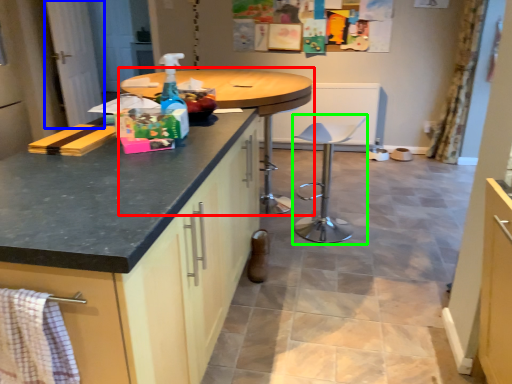
Question: Based on their relative distances, which object is nearer to table (highlighted by a red box)? Choose from screen door (highlighted by a blue box) and swivel chair (highlighted by a green box).

Choices:
 (A) screen door
 (B) swivel chair

Answer: (B)